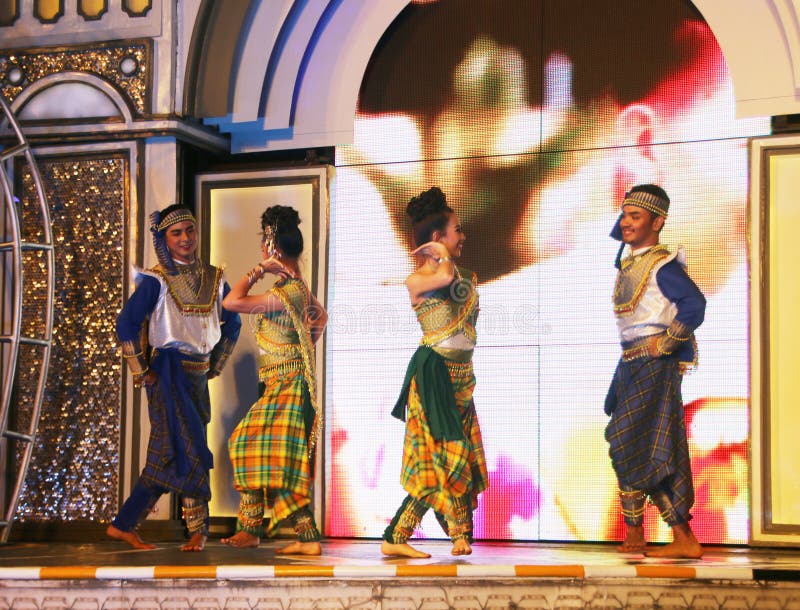
This screenshot has width=800, height=610. In order to click on monitors in this screenshot , I will do `click(496, 92)`, `click(597, 117)`, `click(532, 159)`, `click(597, 289)`, `click(566, 409)`, `click(500, 417)`.